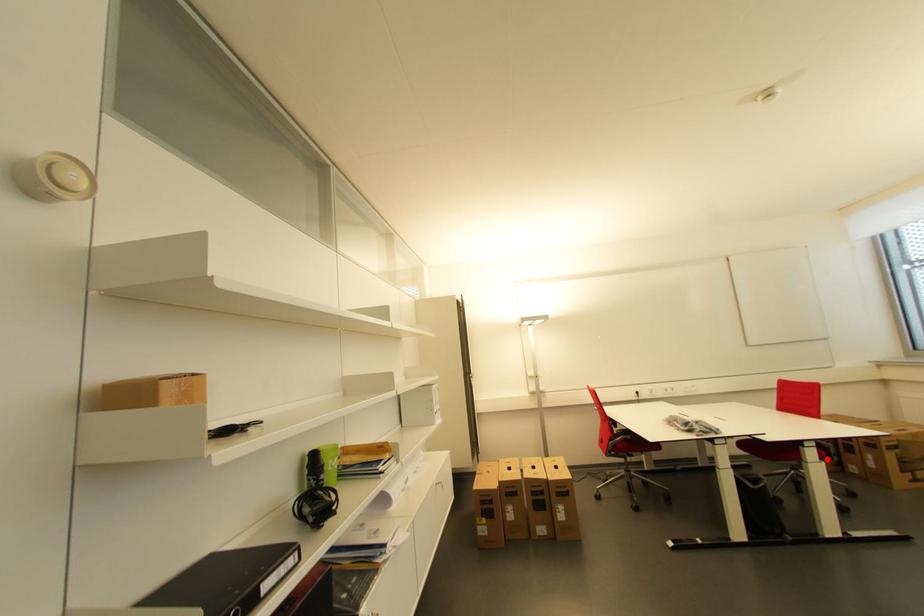
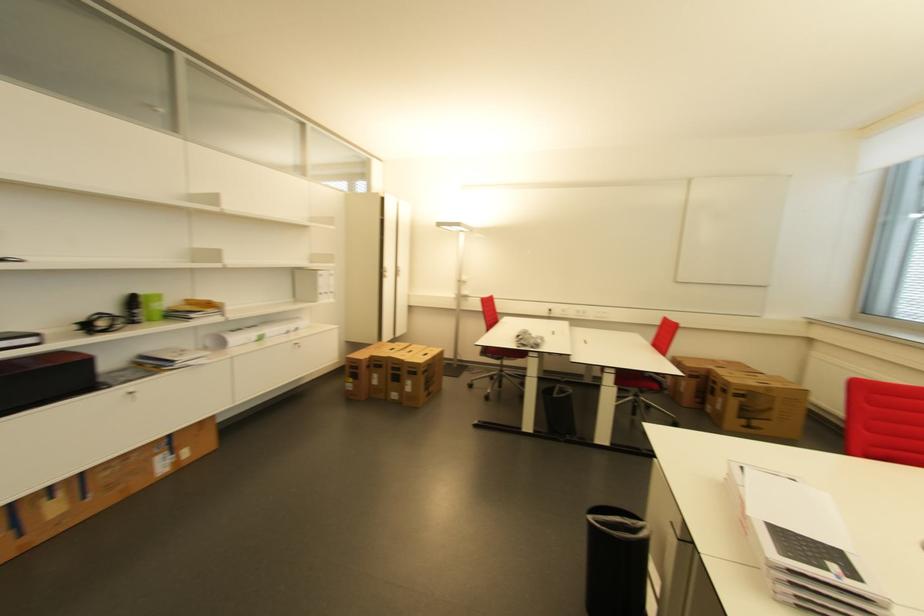
Question: I am providing you with two images of the same scene from different viewpoints. Given a red point in image1, look at the same physical point in image2. Is it:

Choices:
 (A) Closer to the viewpoint
 (B) Farther from the viewpoint

Answer: (B)